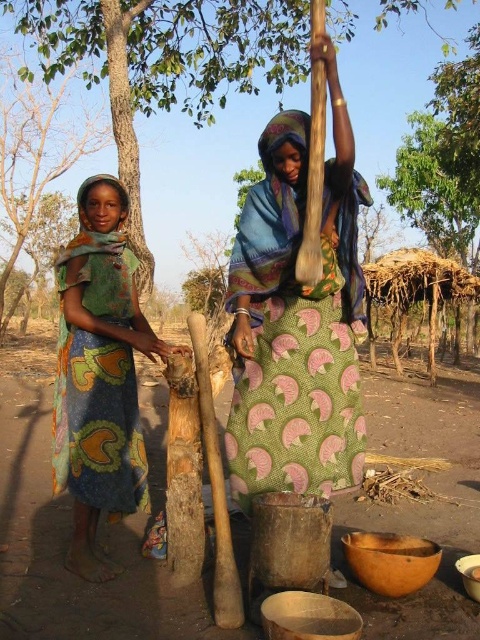
Question: Does blue printed fabric dress at left appear on the left side of green leafy tree at left?

Choices:
 (A) yes
 (B) no

Answer: (B)

Question: Among these points, which one is nearest to the camera?

Choices:
 (A) (336, 156)
 (B) (122, 506)
 (C) (131, 282)

Answer: (A)

Question: Where is green printed dress at left located in relation to blue printed fabric dress at left in the image?

Choices:
 (A) below
 (B) above

Answer: (B)

Question: Can you confirm if green printed dress at left is positioned below blue printed fabric dress at left?

Choices:
 (A) no
 (B) yes

Answer: (A)

Question: Which point is farther to the camera?

Choices:
 (A) (271, 412)
 (B) (1, 291)

Answer: (B)

Question: Among these objects, which one is farthest from the camera?

Choices:
 (A) green leafy tree at left
 (B) green leafy tree at center
 (C) green patterned cloth at center
 (D) green printed dress at left

Answer: (A)